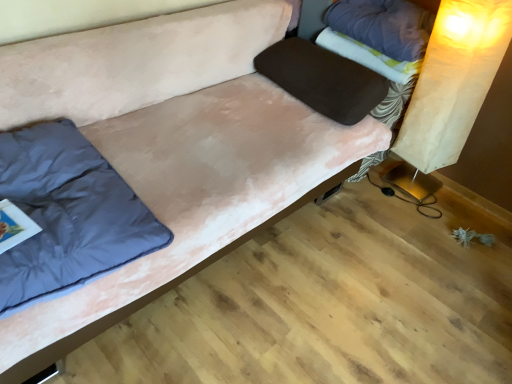
Identify the location of free location to the right of matte paper lampshade at right. (454, 202).